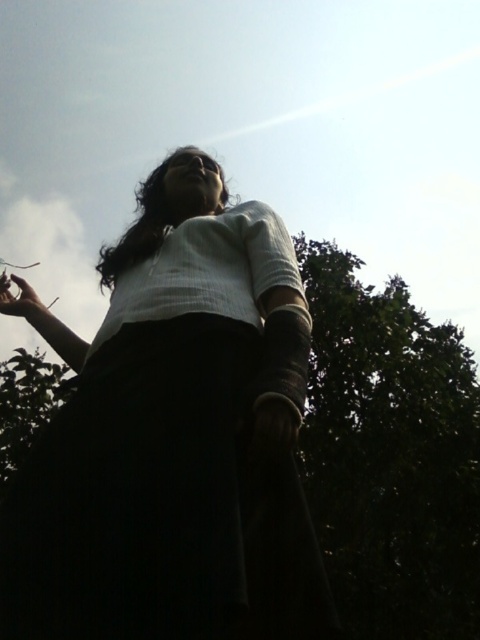
Question: From the image, what is the correct spatial relationship of white matte shirt at center in relation to matte black phone at upper left?

Choices:
 (A) above
 (B) below

Answer: (B)

Question: Is white matte shirt at center smaller than matte black phone at upper left?

Choices:
 (A) yes
 (B) no

Answer: (B)

Question: Which point is closer to the camera taking this photo?

Choices:
 (A) (43, 317)
 (B) (250, 374)

Answer: (B)

Question: Among these objects, which one is farthest from the camera?

Choices:
 (A) white matte shirt at center
 (B) matte black phone at upper left

Answer: (B)

Question: Which point is farther to the camera?

Choices:
 (A) white matte shirt at center
 (B) matte black phone at upper left

Answer: (B)

Question: Can you confirm if white matte shirt at center is positioned above matte black phone at upper left?

Choices:
 (A) yes
 (B) no

Answer: (B)